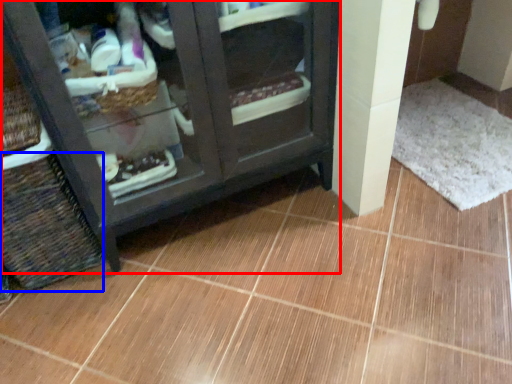
Question: Which object is further to the camera taking this photo, furniture (highlighted by a red box) or basket (highlighted by a blue box)?

Choices:
 (A) furniture
 (B) basket

Answer: (B)